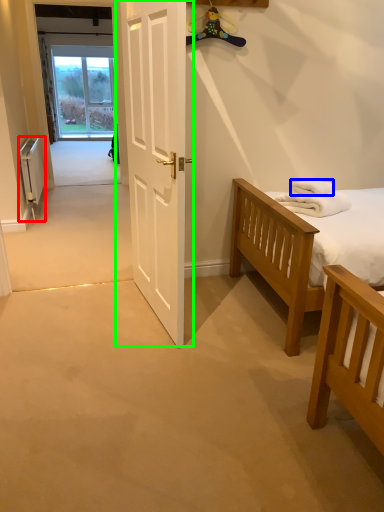
Question: Considering the real-world distances, which object is closest to radiator (highlighted by a red box)? towel/napkin (highlighted by a blue box) or door (highlighted by a green box).

Choices:
 (A) towel/napkin
 (B) door

Answer: (B)